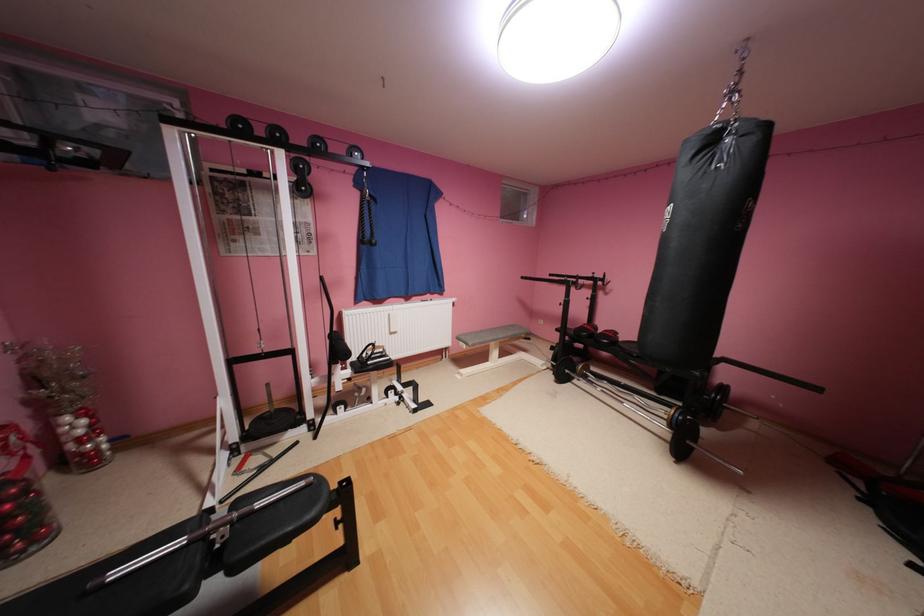
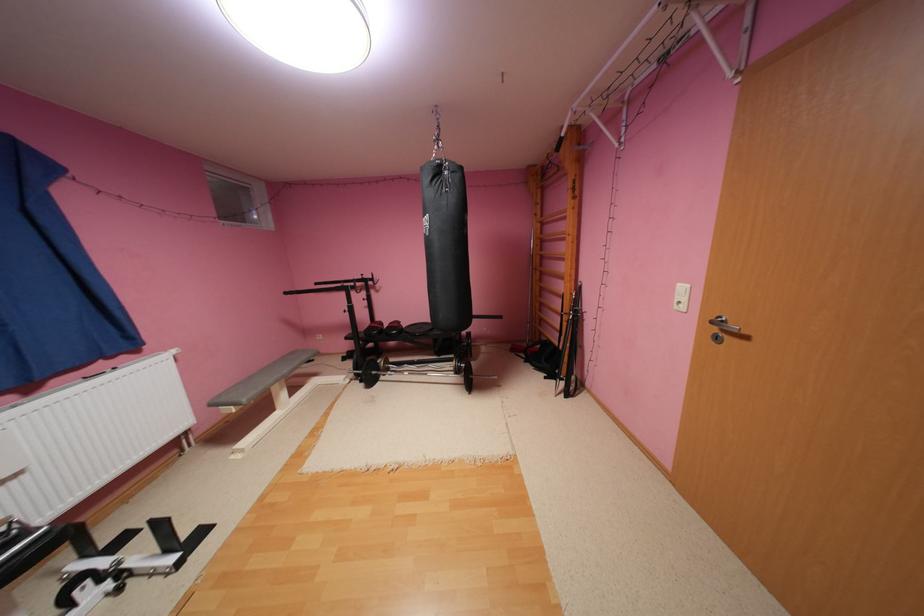
Find the pixel in the second image that matches (x=399, y=333) in the first image.

(11, 483)